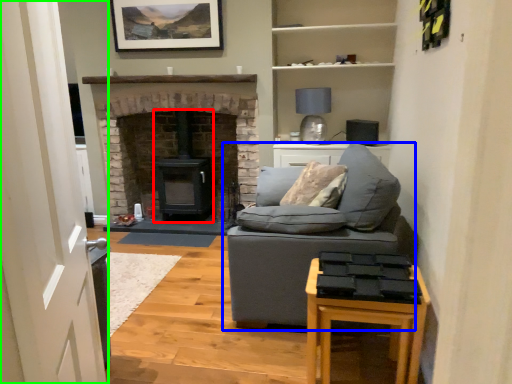
Question: Considering the real-world distances, which object is farthest from wood burning stove (highlighted by a red box)? studio couch (highlighted by a blue box) or glass door (highlighted by a green box)?

Choices:
 (A) studio couch
 (B) glass door

Answer: (B)